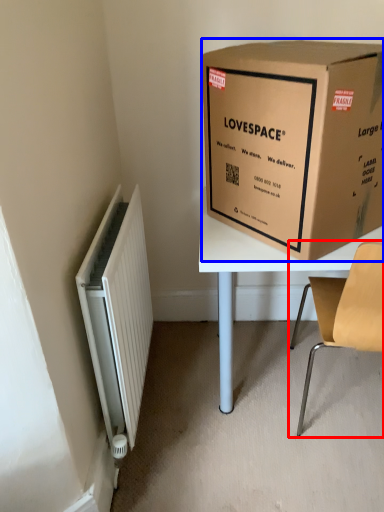
Question: Which object is closer to the camera taking this photo, chair (highlighted by a red box) or box (highlighted by a blue box)?

Choices:
 (A) chair
 (B) box

Answer: (B)